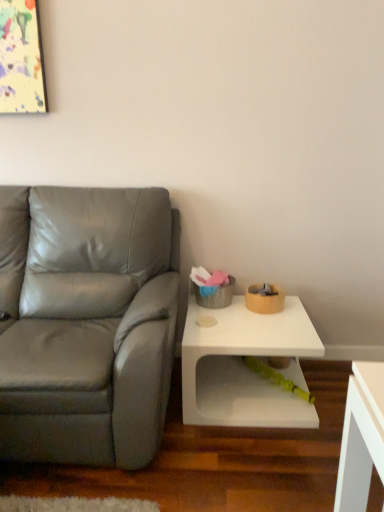
Question: Is matte gray leather couch at left in front of or behind white matte table at lower right in the image?

Choices:
 (A) front
 (B) behind

Answer: (A)

Question: Visually, is matte gray leather couch at left positioned to the left or to the right of white matte table at lower right?

Choices:
 (A) right
 (B) left

Answer: (B)

Question: Which is nearer to the rubberized green toy at lower center?

Choices:
 (A) matte gray leather couch at left
 (B) white matte table at lower right

Answer: (B)

Question: Estimate the real-world distances between objects in this image. Which object is closer to the white matte table at lower right?

Choices:
 (A) matte gray leather couch at left
 (B) rubberized green toy at lower center

Answer: (B)